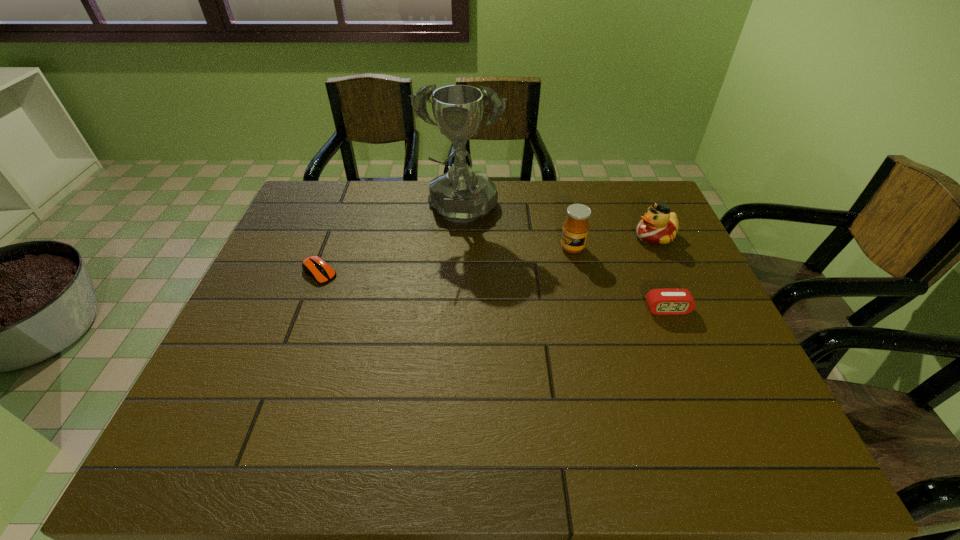
Image resolution: width=960 pixels, height=540 pixels. I want to click on free spot between the third object from left to right and the second shortest object, so click(x=620, y=279).

Find the location of a particular element. free spot between the leftmost object and the tallest object is located at coordinates (391, 242).

At what (x,y) coordinates should I click in order to perform the action: click on unoccupied area between the honey and the nearest object. Please return your answer as a coordinate pair (x, y). The image size is (960, 540). Looking at the image, I should click on (620, 279).

This screenshot has width=960, height=540. Find the location of `vacant area that lies between the fourth farthest object and the third object from right to left`. vacant area that lies between the fourth farthest object and the third object from right to left is located at coordinates (445, 260).

What are the coordinates of `free spot between the computer mouse and the alarm clock` in the screenshot? It's located at (493, 291).

Where is `unoccupied area between the computer mouse and the nearest object`? The image size is (960, 540). unoccupied area between the computer mouse and the nearest object is located at coordinates (493, 291).

Where is `free space between the fourth farthest object and the duck`? The height and width of the screenshot is (540, 960). free space between the fourth farthest object and the duck is located at coordinates (487, 254).

I want to click on unoccupied position between the tallest object and the duck, so click(558, 224).

Where is `free area in between the second nearest object and the honey`? free area in between the second nearest object and the honey is located at coordinates (445, 260).

Identify the location of object that is the second closest one to the third object from right to left. (460, 195).